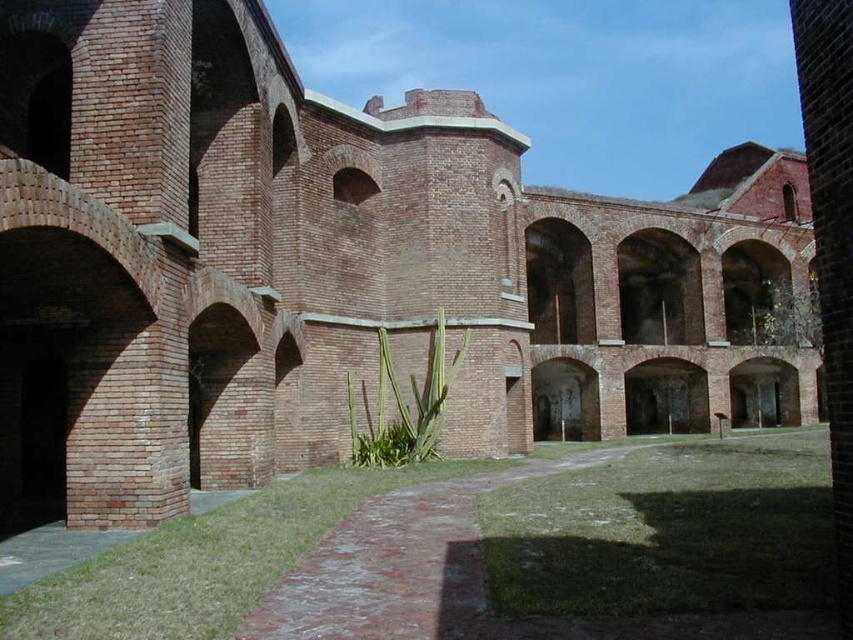
You are standing in the courtyard of a historic brick fortification. You notice a specific point marked at coordinates (770, 509). Considering the courtyard layout described, can you estimate how far this point is from your current position?

The point at (770, 509) is 106.98 feet away from the camera, so it is approximately 107 feet away from your current position in the courtyard.

You are standing in the courtyard and want to walk towards the brick archway at center. Which direction should you move relative to the green grass at center?

Since the green grass at center is in front of the brick archway at center, you should move backward away from the green grass at center to reach the brick archway at center.